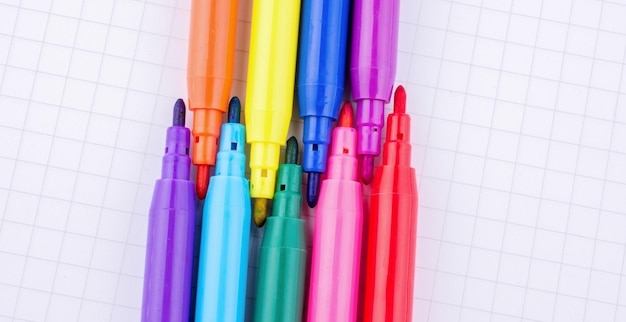
At what (x,y) coordinates should I click in order to perform the action: click on markers. Please return your answer as a coordinate pair (x, y). This screenshot has height=322, width=626. Looking at the image, I should click on (168, 248), (213, 243), (289, 243), (344, 225), (396, 234), (376, 82), (337, 83), (275, 81), (221, 78).